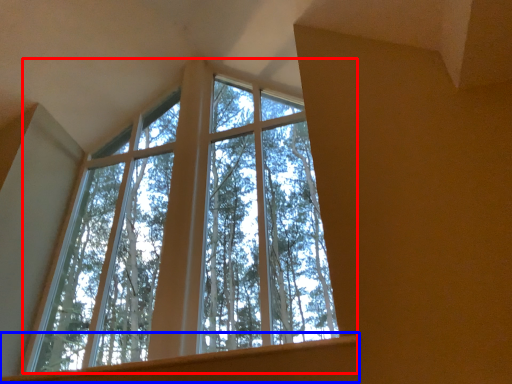
Question: Which point is closer to the camera, window (highlighted by a red box) or window sill (highlighted by a blue box)?

Choices:
 (A) window
 (B) window sill

Answer: (B)